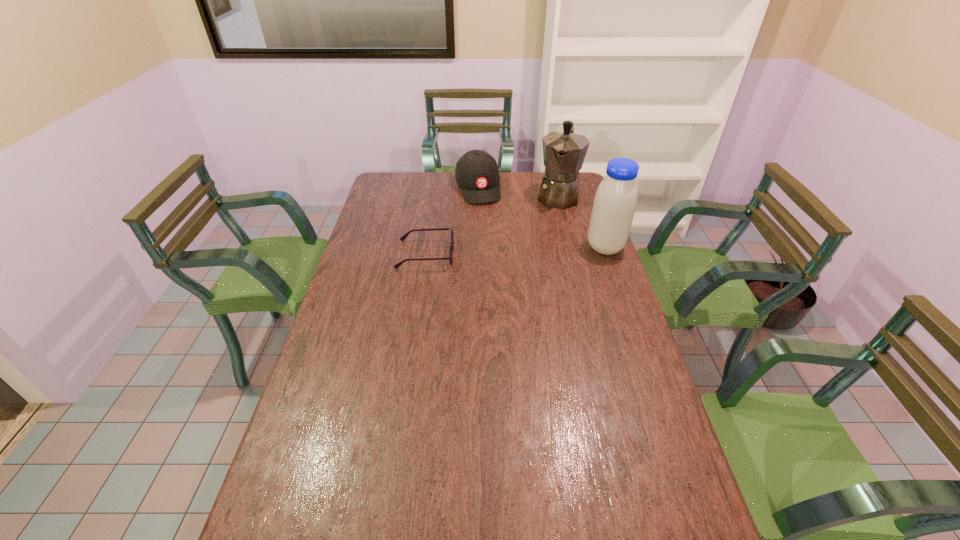
The image size is (960, 540). In order to click on vacant space situated 0.100m with a logo on the front of the third tallest object in this screenshot , I will do `click(487, 218)`.

At what (x,y) coordinates should I click in order to perform the action: click on vacant space located with a logo on the front of the third tallest object. Please return your answer as a coordinate pair (x, y). This screenshot has height=540, width=960. Looking at the image, I should click on (499, 252).

Locate an element on the screen. coffeepot located at the far edge is located at coordinates (564, 152).

Where is `baseball cap situated at the far edge`? This screenshot has height=540, width=960. baseball cap situated at the far edge is located at coordinates 477,175.

The height and width of the screenshot is (540, 960). Identify the location of object situated at the left edge. (403, 237).

Locate an element on the screen. Image resolution: width=960 pixels, height=540 pixels. soya milk that is at the right edge is located at coordinates (615, 201).

Locate an element on the screen. This screenshot has height=540, width=960. coffeepot at the right edge is located at coordinates (564, 152).

Identify the location of object present at the far right corner. (564, 152).

Locate an element on the screen. The image size is (960, 540). vacant space at the far edge of the desktop is located at coordinates (526, 185).

The width and height of the screenshot is (960, 540). What are the coordinates of `free space at the left edge of the desktop` in the screenshot? It's located at (406, 212).